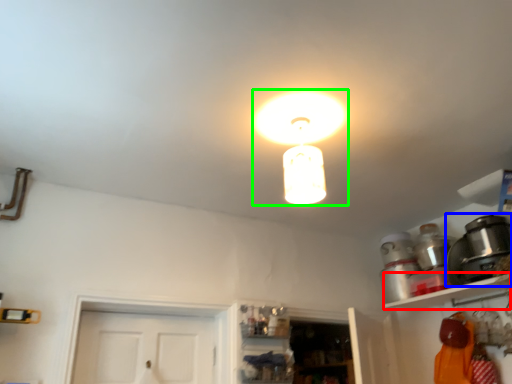
Question: Based on their relative distances, which object is farther from shelf (highlighted by a red box)? Choose from appliance (highlighted by a blue box) and lamp (highlighted by a green box).

Choices:
 (A) appliance
 (B) lamp

Answer: (B)